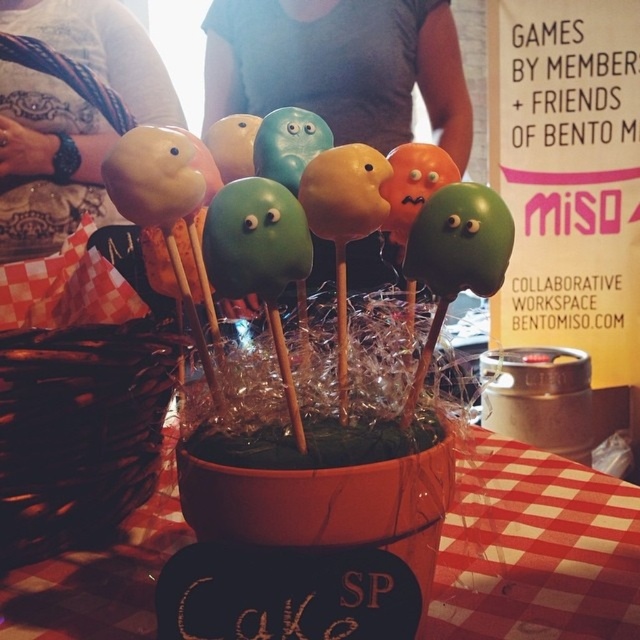
Can you confirm if brown woven basket at center is thinner than matte gray shirt at center?

Correct, brown woven basket at center's width is less than matte gray shirt at center's.

Between point (132, 444) and point (244, 65), which one is positioned in front?

Point (132, 444) is in front.

Find the location of `brown woven basket at center`. brown woven basket at center is located at coordinates (77, 432).

Can you confirm if red checkered tablecloth at center is taller than matte black cake pops at left?

Incorrect, red checkered tablecloth at center's height is not larger of matte black cake pops at left's.

Who is lower down, red checkered tablecloth at center or matte black cake pops at left?

red checkered tablecloth at center is below.

Locate an element on the screen. Image resolution: width=640 pixels, height=640 pixels. red checkered tablecloth at center is located at coordinates (536, 548).

Which of these two, red checkered tablecloth at center or matte gray shirt at center, stands shorter?

red checkered tablecloth at center is shorter.

Describe the element at coordinates (536, 548) in the screenshot. I see `red checkered tablecloth at center` at that location.

Does point (481, 621) come closer to viewer compared to point (376, 10)?

Yes, point (481, 621) is in front of point (376, 10).

You are a GUI agent. You are given a task and a screenshot of the screen. Output one action in this format:
    pyautogui.click(x=<x>, y=<y>)
    Task: Click on the red checkered tablecloth at center
    
    Given the screenshot: What is the action you would take?
    pyautogui.click(x=536, y=548)